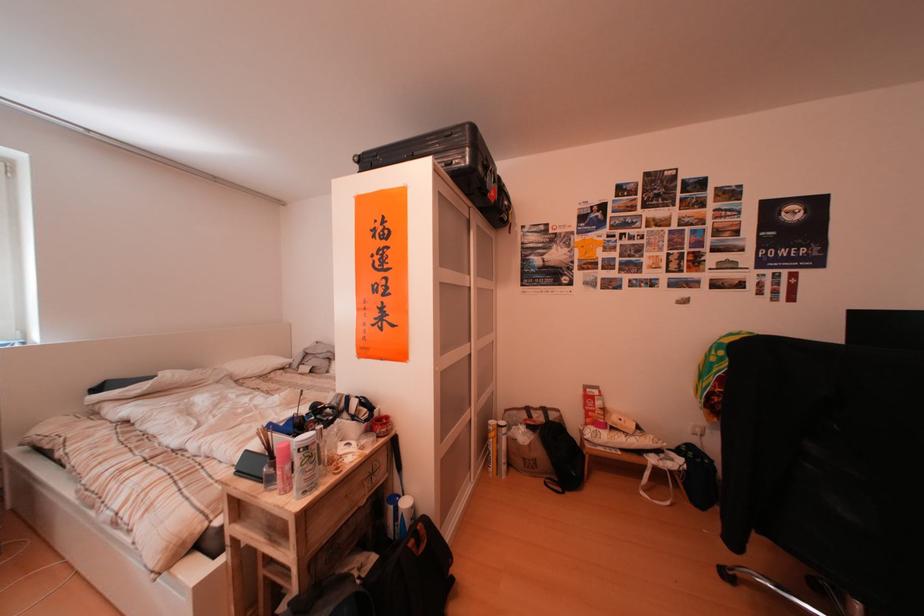
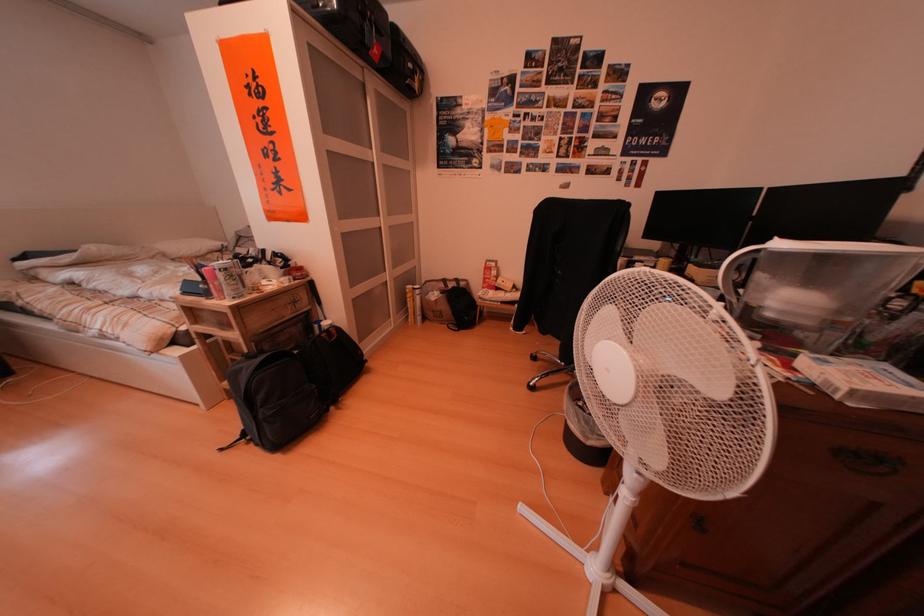
Question: The images are taken continuously from a first-person perspective. In which direction is your viewpoint rotating?

Choices:
 (A) Left
 (B) Right
 (C) Up
 (D) Down

Answer: (D)